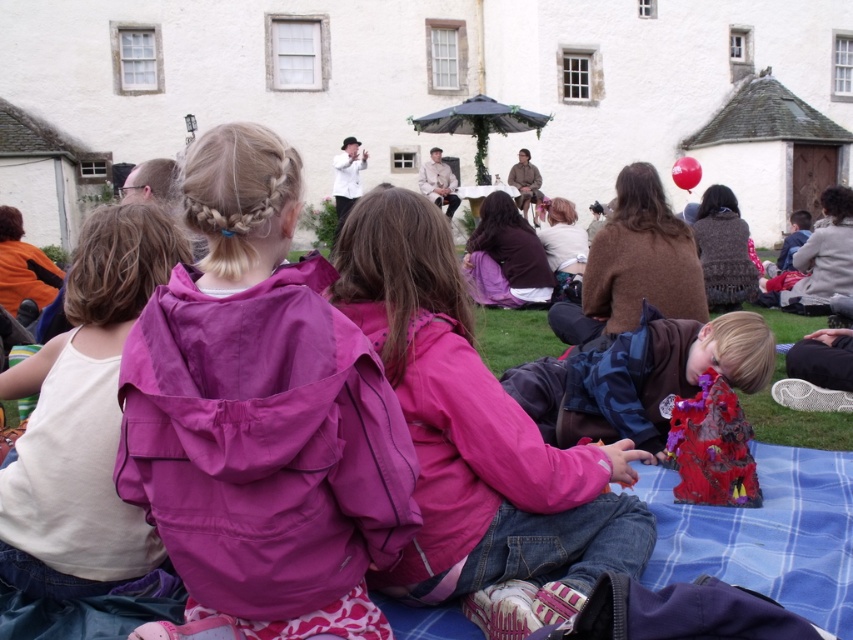
Question: Estimate the real-world distances between objects in this image. Which object is closer to the white fabric shirt at left?

Choices:
 (A) dark blue fabric at lower right
 (B) purple fabric jacket at center
 (C) pink fabric jacket at center
 (D) shiny plastic toy at lower right

Answer: (C)

Question: Is white fabric shirt at left below dark blue fabric at lower right?

Choices:
 (A) no
 (B) yes

Answer: (A)

Question: Which object is positioned farthest from the shiny plastic toy at lower right?

Choices:
 (A) pink fabric jacket at center
 (B) dark blue fabric at lower right

Answer: (A)

Question: Which point is closer to the camera?

Choices:
 (A) (714, 490)
 (B) (634, 396)
 (C) (386, 269)
 (D) (106, 570)

Answer: (D)

Question: Is purple fabric jacket at center to the left of dark blue fabric at lower right from the viewer's perspective?

Choices:
 (A) yes
 (B) no

Answer: (A)

Question: Does purple fabric jacket at center have a larger size compared to white fabric shirt at left?

Choices:
 (A) no
 (B) yes

Answer: (B)